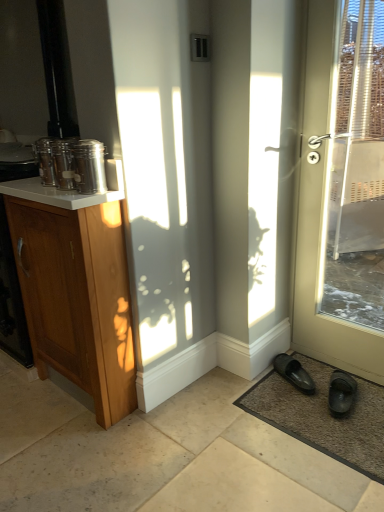
Image resolution: width=384 pixels, height=512 pixels. In order to click on free spot to the left of brown textured mat at lower right in this screenshot , I will do `click(217, 436)`.